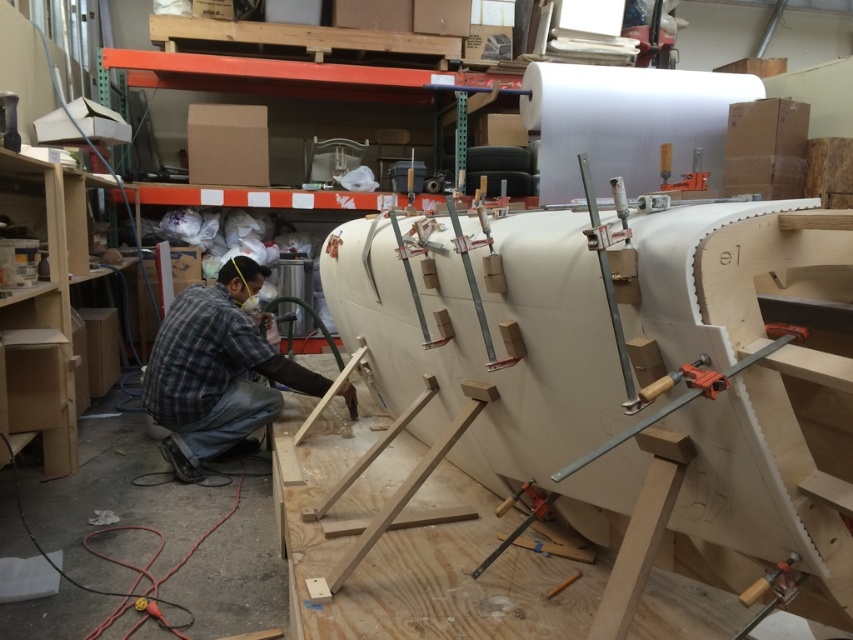
Question: Which object appears farthest from the camera in this image?

Choices:
 (A) plaid fabric shirt at lower left
 (B) metallic clamp at upper right

Answer: (A)

Question: Which point appears closest to the camera in this image?

Choices:
 (A) (250, 280)
 (B) (660, 168)

Answer: (B)

Question: Does plaid fabric shirt at lower left appear over metallic clamp at upper right?

Choices:
 (A) no
 (B) yes

Answer: (A)

Question: From the image, what is the correct spatial relationship of plaid fabric shirt at lower left in relation to metallic clamp at upper right?

Choices:
 (A) right
 (B) left

Answer: (B)

Question: Does plaid fabric shirt at lower left have a smaller size compared to metallic clamp at upper right?

Choices:
 (A) no
 (B) yes

Answer: (A)